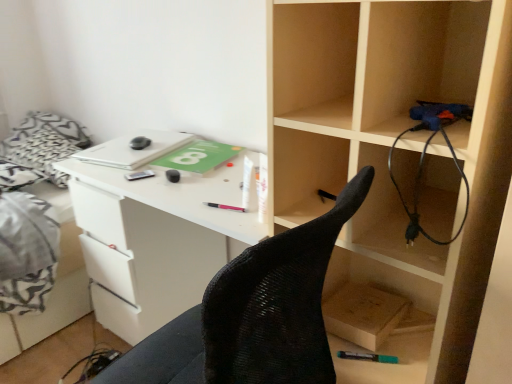
Question: Is white fabric bed at left inside or outside of metallic silver pen at center, the fourth stationery when ordered from right to left?

Choices:
 (A) inside
 (B) outside

Answer: (B)

Question: In the image, is white fabric bed at left on the left side or the right side of metallic silver pen at center, the 3th stationery from the bottom?

Choices:
 (A) left
 (B) right

Answer: (A)

Question: Which of these objects is positioned farthest from the metallic silver pen at center, the fourth stationery when ordered from right to left?

Choices:
 (A) black rubber mouse at center, which ranks as the fourth stationery in bottom-to-top order
 (B) teal matte marker at lower center, which is the 4th stationery from top to bottom
 (C) black rubber wire at right
 (D) black mesh chair at center
 (E) wooden box at lower right

Answer: (C)

Question: Which is nearer to the wooden box at lower right?

Choices:
 (A) pink plastic pen at center, acting as the 2th stationery starting from the bottom
 (B) teal matte marker at lower center, the first stationery from the right
 (C) metallic silver pen at center, the fourth stationery when ordered from right to left
 (D) white fabric bed at left
 (E) black rubber mouse at center, which is the 1th stationery from top to bottom

Answer: (B)